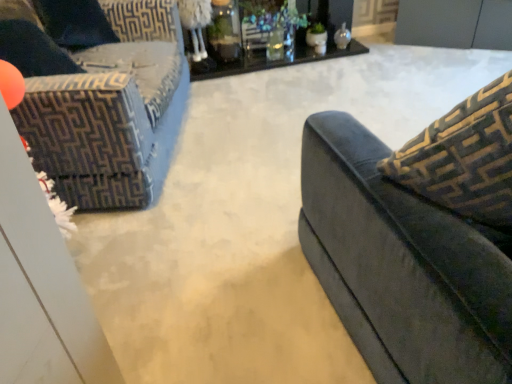
Question: Is velvet dark blue couch at left wider or thinner than black glass table at upper center?

Choices:
 (A) wide
 (B) thin

Answer: (A)

Question: In terms of height, does velvet dark blue couch at left look taller or shorter compared to black glass table at upper center?

Choices:
 (A) short
 (B) tall

Answer: (B)

Question: Is velvet dark blue couch at left in front of or behind black glass table at upper center in the image?

Choices:
 (A) front
 (B) behind

Answer: (A)

Question: From the image's perspective, is black glass table at upper center positioned above or below velvet dark blue couch at left?

Choices:
 (A) above
 (B) below

Answer: (A)

Question: Would you say black glass table at upper center is inside or outside velvet dark blue couch at left?

Choices:
 (A) inside
 (B) outside

Answer: (B)

Question: From a real-world perspective, is black glass table at upper center positioned above or below velvet dark blue couch at left?

Choices:
 (A) above
 (B) below

Answer: (B)

Question: Relative to velvet dark blue couch at left, is black glass table at upper center in front or behind?

Choices:
 (A) behind
 (B) front

Answer: (A)